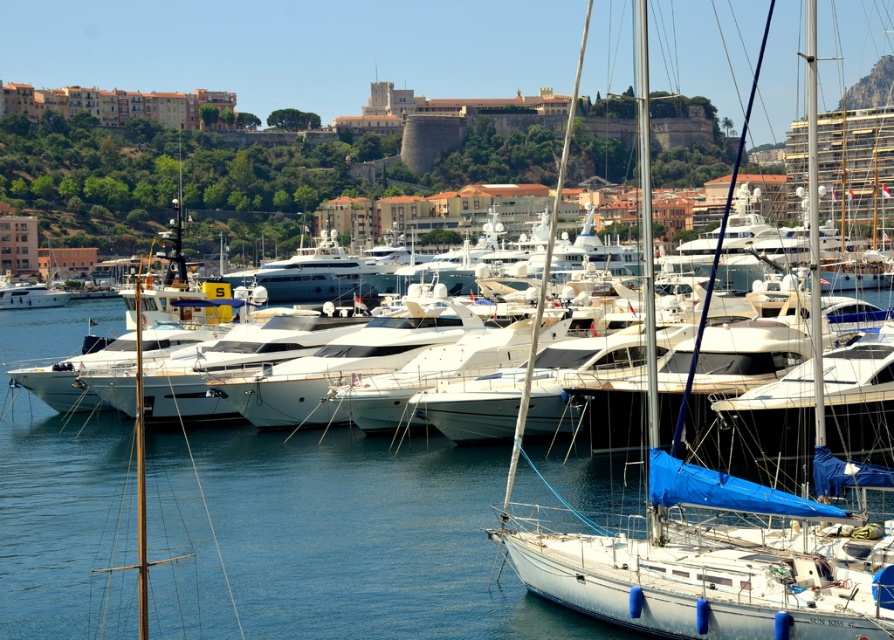
Is point (187, 467) positioned after point (515, 422)?

Yes, point (187, 467) is farther from viewer.

The image size is (894, 640). I want to click on clear blue water at center, so click(x=334, y=538).

Between clear blue water at center and white glossy yacht at left, which one is positioned higher?

Positioned higher is white glossy yacht at left.

Does clear blue water at center appear under white glossy yacht at left?

Yes, clear blue water at center is below white glossy yacht at left.

Between point (89, 604) and point (13, 307), which one is positioned in front?

Point (89, 604) is more forward.

The image size is (894, 640). Find the location of `clear blue water at center`. clear blue water at center is located at coordinates (334, 538).

Can you confirm if white sailboat at center is positioned to the left of white glossy yacht at left?

Incorrect, white sailboat at center is not on the left side of white glossy yacht at left.

Between white sailboat at center and white glossy yacht at left, which one has more height?

Standing taller between the two is white sailboat at center.

At what (x,y) coordinates should I click in order to perform the action: click on white sailboat at center. Please return your answer as a coordinate pair (x, y). Looking at the image, I should click on (646, 228).